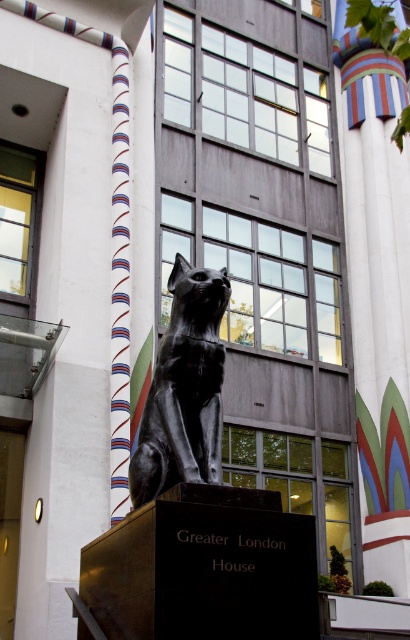
You are standing in front of Greater London House and notice two central elements. The white striped pillar at center and the black polished stone cat at center. Which one is positioned to the right?

The white striped pillar at center is to the right of the black polished stone cat at center.

You are an architect visiting Greater London House and want to compare the widths of the white striped pillar at center and the black polished stone cat at center. Which object is wider?

The white striped pillar at center is wider than the black polished stone cat at center.

You are standing in front of the Greater London House building and want to locate the white striped pillar at center. According to the coordinates provided, where exactly would you find it in relation to the building?

The white striped pillar at center is located at the coordinates point (377, 292) on the 2D plane.